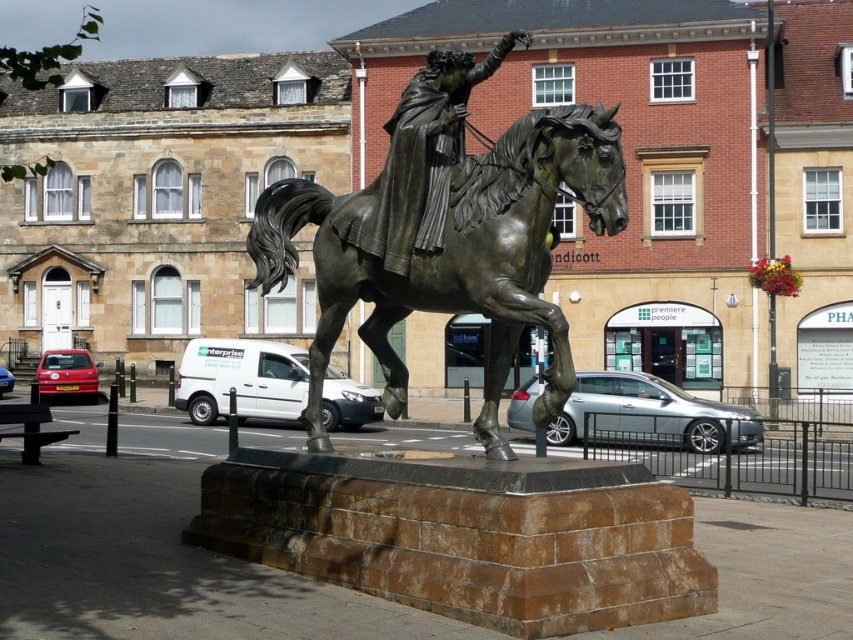
Between bronze/statue at center and bronze statue at center, which one appears on the right side from the viewer's perspective?

bronze statue at center

Is point (614, 224) less distant than point (437, 204)?

Yes, point (614, 224) is in front of point (437, 204).

This screenshot has width=853, height=640. In order to click on bronze/statue at center in this screenshot , I will do pyautogui.click(x=457, y=257).